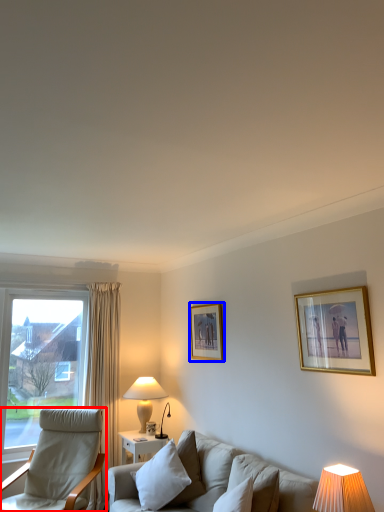
Question: Among these objects, which one is farthest to the camera, chair (highlighted by a red box) or picture frame (highlighted by a blue box)?

Choices:
 (A) chair
 (B) picture frame

Answer: (B)